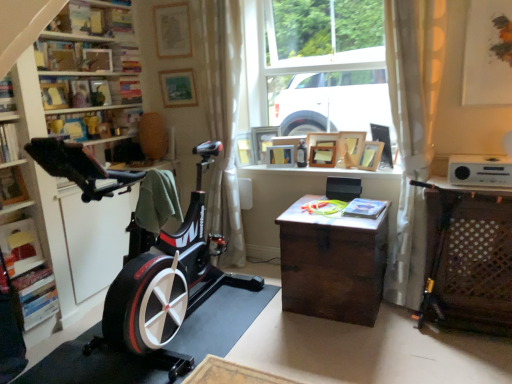
Find the location of `free space in front of white sheer curtain at center, which is counted as the second curtain, starting from the right`. free space in front of white sheer curtain at center, which is counted as the second curtain, starting from the right is located at coordinates (236, 287).